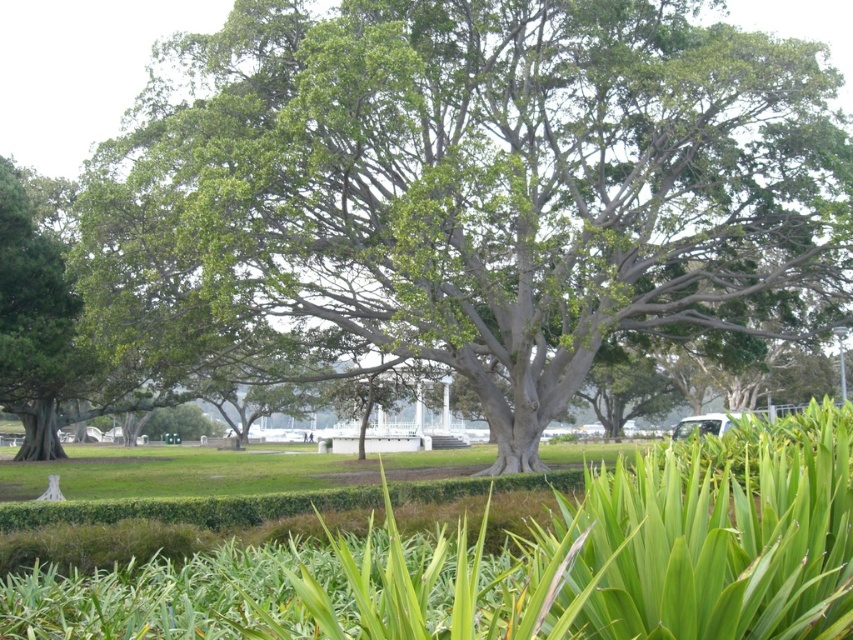
You are standing in the garden and want to walk from the green leafy grass at center to the green leafy tree at center. Which direction should you move to get closer to the tree?

You should move forward because the green leafy tree at center is closer to you than the green leafy grass at center, so moving forward towards the tree will bring you closer.

You are standing in the garden and want to take a photo of the green leafy tree at center. If your camera has a viewfinder that shows coordinates from 0 to 1 on both axes, where would you aim your camera to capture the tree?

The green leafy tree at center is located at coordinates point (490, 186), so you should aim your camera at those coordinates to capture the tree.

You are standing in the garden and want to walk from the green leafy grass at center to the green leafy tree at center. Which direction should you move?

You should move to the left because the green leafy tree at center is to the right of the green leafy grass at center, so moving left will take you towards it.